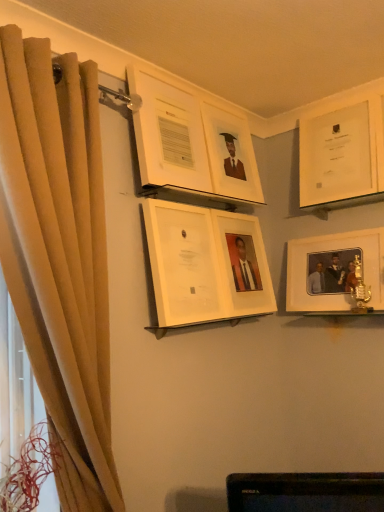
Question: From the image's perspective, relative to beige fabric curtain at left, is white matte picture frame at right, marked as the 2th picture frame in a right-to-left arrangement, above or below?

Choices:
 (A) below
 (B) above

Answer: (B)

Question: Considering the positions of white matte picture frame at right, marked as the 2th picture frame in a right-to-left arrangement, and beige fabric curtain at left in the image, is white matte picture frame at right, marked as the 2th picture frame in a right-to-left arrangement, wider or thinner than beige fabric curtain at left?

Choices:
 (A) wide
 (B) thin

Answer: (B)

Question: Which object is the closest to the white glossy picture frame at upper right, acting as the first picture frame starting from the right?

Choices:
 (A) white glossy picture frame at center, which is the fifth picture frame in right-to-left order
 (B) matte white picture frame at upper center, which ranks as the 4th picture frame in right-to-left order
 (C) white matte picture frame at center, positioned as the fourth picture frame in left-to-right order
 (D) white matte picture frame at right, marked as the 2th picture frame in a right-to-left arrangement
 (E) white glossy picture frame at upper center, positioned as the sixth picture frame in right-to-left order

Answer: (D)

Question: Estimate the real-world distances between objects in this image. Which object is farther from the white glossy picture frame at center, which is the fifth picture frame in right-to-left order?

Choices:
 (A) matte white picture frame at upper center, acting as the third picture frame starting from the left
 (B) white glossy picture frame at upper center, positioned as the sixth picture frame in right-to-left order
 (C) white glossy picture frame at upper right, acting as the first picture frame starting from the right
 (D) white matte picture frame at right, marked as the 2th picture frame in a right-to-left arrangement
 (E) white matte picture frame at center, the third picture frame in the right-to-left sequence

Answer: (C)